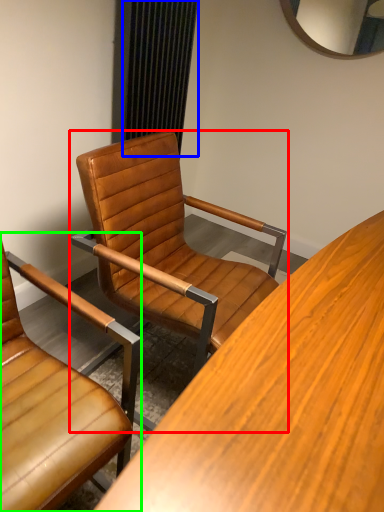
Question: Based on their relative distances, which object is farther from chair (highlighted by a red box)? Choose from curtain (highlighted by a blue box) and chair (highlighted by a green box).

Choices:
 (A) curtain
 (B) chair

Answer: (A)